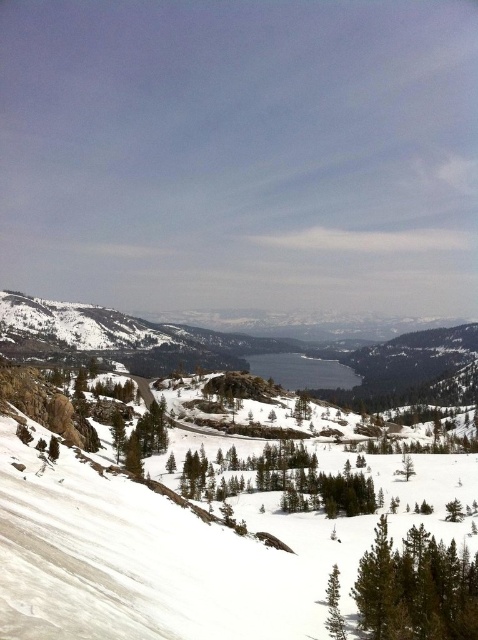
Can you confirm if green matte tree at lower right is shorter than green textured pine tree at lower center?

No.

Describe the element at coordinates (416, 588) in the screenshot. I see `green matte tree at lower right` at that location.

Is point (440, 621) farther from camera compared to point (337, 614)?

No, it is in front of (337, 614).

Locate an element on the screen. green matte tree at lower right is located at coordinates (416, 588).